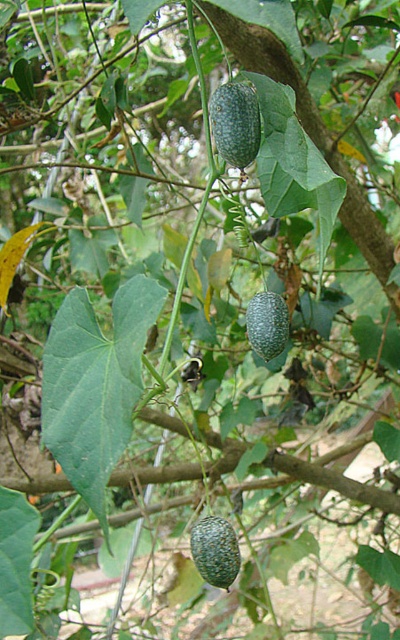
You are standing in a garden and see two points marked in the image. Which point is closer to you, point (249, 88) or point (214, 582)?

Point (249, 88) is further to the viewer than point (214, 582), so the closer point to you is point (214, 582).